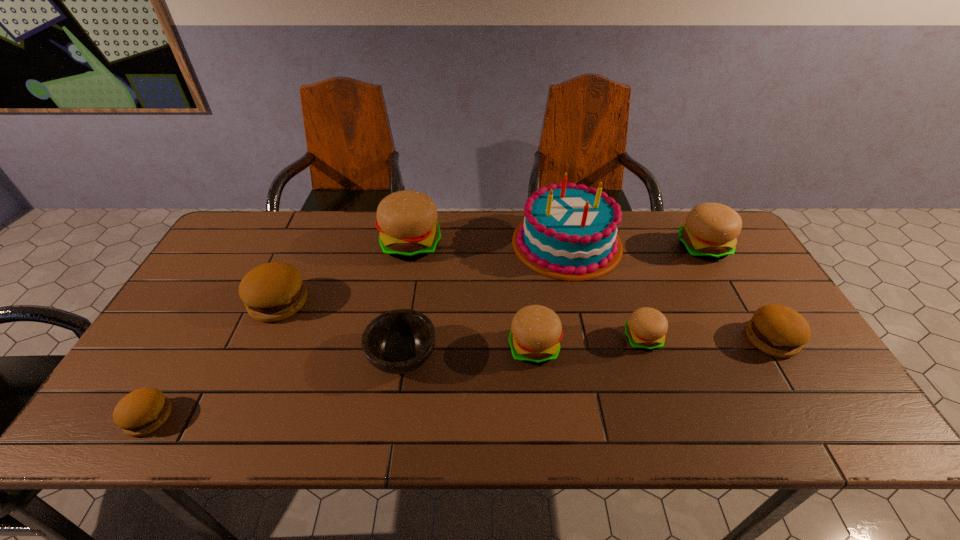
At what (x,y) coordinates should I click in order to perform the action: click on vacant area situated on the left of the eighth object from right to left. Please return your answer as a coordinate pair (x, y). This screenshot has width=960, height=540. Looking at the image, I should click on (206, 302).

The width and height of the screenshot is (960, 540). What are the coordinates of `vacant space located 0.170m on the back of the second biggest brown hamburger` in the screenshot? It's located at (733, 276).

Where is `vacant space located on the right of the smallest beige hamburger`? The image size is (960, 540). vacant space located on the right of the smallest beige hamburger is located at coordinates (708, 339).

Locate an element on the screen. The width and height of the screenshot is (960, 540). vacant space located 0.100m on the front of the brown bowl is located at coordinates (392, 427).

This screenshot has height=540, width=960. What are the coordinates of `vacant space positioned 0.340m on the back of the leftmost object` in the screenshot? It's located at (222, 292).

You are a GUI agent. You are given a task and a screenshot of the screen. Output one action in this format:
    pyautogui.click(x=<x>, y=<y>)
    Task: Click on the birthday cake at the far edge
    The height and width of the screenshot is (540, 960).
    Given the screenshot: What is the action you would take?
    pyautogui.click(x=569, y=232)

At what (x,y) coordinates should I click in order to perform the action: click on object positioned at the near edge. Please return your answer as a coordinate pair (x, y). Image resolution: width=960 pixels, height=540 pixels. Looking at the image, I should click on (142, 411).

You are a GUI agent. You are given a task and a screenshot of the screen. Output one action in this format:
    pyautogui.click(x=<x>, y=<y>)
    Task: Click on the object that is at the left edge
    The width and height of the screenshot is (960, 540).
    Given the screenshot: What is the action you would take?
    pyautogui.click(x=142, y=411)

This screenshot has height=540, width=960. What are the coordinates of `object that is at the near left corner` in the screenshot? It's located at (142, 411).

In order to click on object that is at the far right corner in this screenshot , I will do `click(710, 231)`.